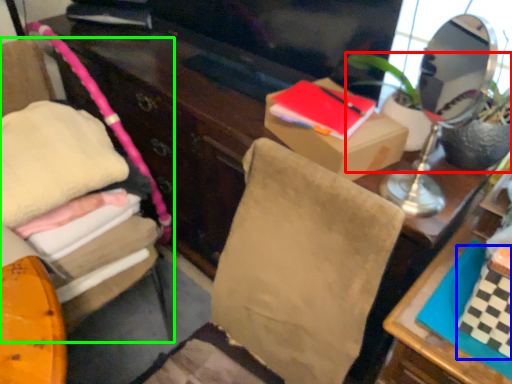
Question: Which object is the closest to the houseplant (highlighted by a red box)? Choose among these: book (highlighted by a blue box) or furniture (highlighted by a green box).

Choices:
 (A) book
 (B) furniture

Answer: (A)